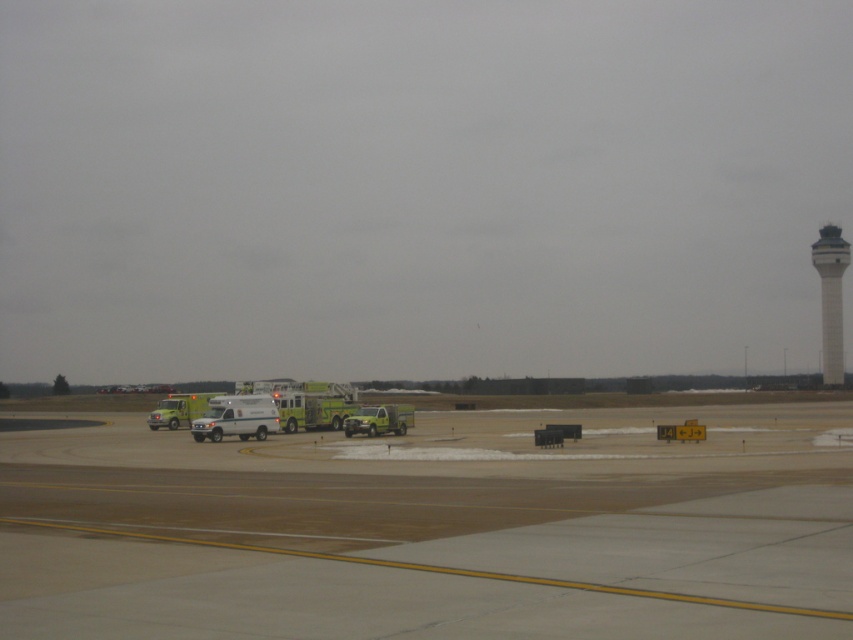
Can you confirm if white concrete control tower at upper right is positioned above white matte van at center?

Indeed, white concrete control tower at upper right is positioned over white matte van at center.

Can you confirm if white concrete control tower at upper right is positioned to the left of white matte van at center?

In fact, white concrete control tower at upper right is to the right of white matte van at center.

The image size is (853, 640). Identify the location of white concrete control tower at upper right. (830, 298).

The height and width of the screenshot is (640, 853). What are the coordinates of `white concrete control tower at upper right` in the screenshot? It's located at (830, 298).

Does white matte van at center have a smaller size compared to green matte fire truck at left?

Correct, white matte van at center occupies less space than green matte fire truck at left.

Is the position of white matte van at center more distant than that of green matte fire truck at left?

No.

Between point (250, 404) and point (173, 404), which one is positioned in front?

Positioned in front is point (250, 404).

Find the location of `white matte van at center`. white matte van at center is located at coordinates (236, 417).

Which is in front, point (210, 408) or point (367, 419)?

Positioned in front is point (367, 419).

Measure the distance between white matte van at center and camera.

52.32 meters

This screenshot has height=640, width=853. I want to click on white matte van at center, so click(236, 417).